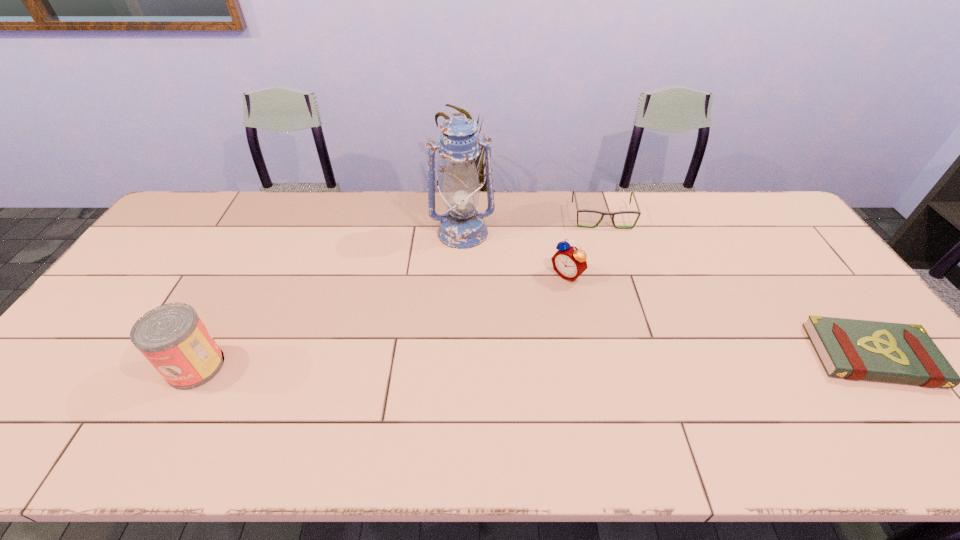
At what (x,y) coordinates should I click in order to perform the action: click on free point located 0.140m on the front-facing side of the tallest object. Please return your answer as a coordinate pair (x, y). This screenshot has height=540, width=960. Looking at the image, I should click on (471, 280).

Locate an element on the screen. The height and width of the screenshot is (540, 960). spectacles situated at the far edge is located at coordinates (638, 212).

Image resolution: width=960 pixels, height=540 pixels. Identify the location of lantern situated at the far edge. (462, 227).

Find the location of a particular element. can at the near edge is located at coordinates tap(172, 337).

Locate an element on the screen. Image resolution: width=960 pixels, height=540 pixels. book present at the near edge is located at coordinates (852, 349).

The height and width of the screenshot is (540, 960). In order to click on object that is at the right edge in this screenshot , I will do `click(852, 349)`.

Find the location of a particular element. object that is at the near right corner is located at coordinates (852, 349).

In the image, there is a desktop. Identify the location of vacant space at the far edge. The width and height of the screenshot is (960, 540). (434, 232).

In the image, there is a desktop. Where is `vacant space at the near edge`? This screenshot has height=540, width=960. vacant space at the near edge is located at coordinates (828, 388).

Identify the location of vacant space at the right edge of the desktop. This screenshot has height=540, width=960. (794, 241).